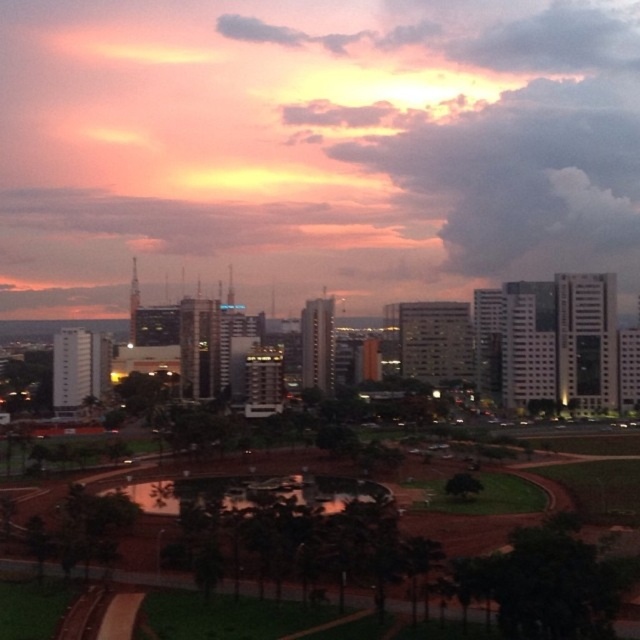
You are standing in the city park and see the matte orange sky at upper center and the green grass at center. Which object is positioned to the left when facing the scene?

The matte orange sky at upper center is to the left of the green grass at center.

You are standing in the cityscape and want to walk from the point at coordinates point (20, 269) to the point at coordinates point (195, 566). Which direction should you move to get closer to your destination?

Since point (20, 269) is further to the viewer than point (195, 566), you should move away from the foreground towards the background to reach your destination.

You are a drone operator who needs to fly a drone from the matte orange sky at upper center to the green grass at center. What is the minimum vertical distance you need to descend?

The minimum vertical distance to descend is 12.80 feet.